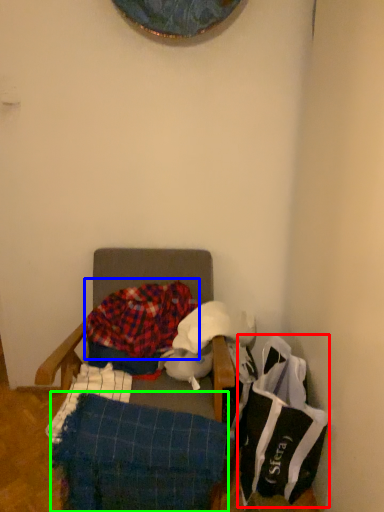
Question: Based on their relative distances, which object is nearer to material (highlighted by a red box)? Choose from blanket (highlighted by a blue box) and blanket (highlighted by a green box).

Choices:
 (A) blanket
 (B) blanket

Answer: (B)